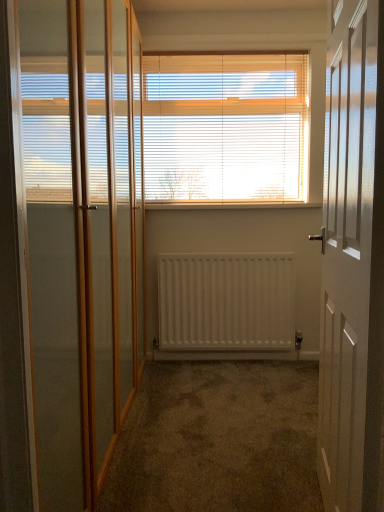
The height and width of the screenshot is (512, 384). I want to click on clear glass screen door at left, so click(81, 233).

The width and height of the screenshot is (384, 512). Find the location of `white wood blinds at center`. white wood blinds at center is located at coordinates (225, 127).

From the image's perspective, is white wood blinds at center located above white matte radiator at center?

Yes, from the image's perspective, white wood blinds at center is over white matte radiator at center.

Is white wood blinds at center closer to camera compared to white matte radiator at center?

Yes, white wood blinds at center is closer to the camera.

Between white wood blinds at center and white matte radiator at center, which one has less height?

white matte radiator at center.

In the scene shown: From a real-world perspective, who is located lower, white wood blinds at center or white matte radiator at center?

white matte radiator at center, from a real-world perspective.

Locate an element on the screen. The width and height of the screenshot is (384, 512). window blind above the white wooden door at right (from a real-world perspective) is located at coordinates (225, 127).

Is white wood blinds at center oriented away from white wooden door at right?

No.

How many degrees apart are the facing directions of white wood blinds at center and white wooden door at right?

The angle between the facing direction of white wood blinds at center and the facing direction of white wooden door at right is 99.7 degrees.

How far apart are white wood blinds at center and white wooden door at right?

white wood blinds at center and white wooden door at right are 5.24 feet apart from each other.

Between wooden at center and clear glass screen door at left, which one has more height?

Standing taller between the two is clear glass screen door at left.

Between wooden at center and clear glass screen door at left, which one appears on the left side from the viewer's perspective?

clear glass screen door at left.

Is wooden at center closer to camera compared to clear glass screen door at left?

No, wooden at center is further to the viewer.

The width and height of the screenshot is (384, 512). I want to click on screen door that is in front of the wooden at center, so click(81, 233).

Which of these two, white wooden door at right or white matte radiator at center, stands shorter?

white matte radiator at center.

Considering the positions of objects white wooden door at right and white matte radiator at center in the image provided, who is more to the right, white wooden door at right or white matte radiator at center?

From the viewer's perspective, white wooden door at right appears more on the right side.

The image size is (384, 512). In order to click on door above the white matte radiator at center (from a real-world perspective) in this screenshot , I will do `click(353, 266)`.

Considering the sizes of objects white wooden door at right and white matte radiator at center in the image provided, who is thinner, white wooden door at right or white matte radiator at center?

Thinner between the two is white matte radiator at center.

Is white matte radiator at center taller than clear glass screen door at left?

Incorrect, the height of white matte radiator at center is not larger of that of clear glass screen door at left.

Is white matte radiator at center inside the boundaries of clear glass screen door at left, or outside?

white matte radiator at center exists outside the volume of clear glass screen door at left.

Measure the distance from white matte radiator at center to clear glass screen door at left.

4.06 feet.

Is white matte radiator at center oriented away from clear glass screen door at left?

Answer: No, white matte radiator at center's orientation is not away from clear glass screen door at left.

Is clear glass screen door at left turned away from white wooden door at right?

No, clear glass screen door at left is not facing the opposite direction of white wooden door at right.

Considering the sizes of clear glass screen door at left and white wooden door at right in the image, is clear glass screen door at left wider or thinner than white wooden door at right?

Clearly, clear glass screen door at left has more width compared to white wooden door at right.

Can you confirm if clear glass screen door at left is positioned to the left of white wooden door at right?

Yes.

How different are the orientations of clear glass screen door at left and white wooden door at right in degrees?

The facing directions of clear glass screen door at left and white wooden door at right are 171 degrees apart.

Can you confirm if white wood blinds at center is positioned to the left of wooden at center?

Yes.

Which object is wider, white wood blinds at center or wooden at center?

wooden at center.

From the image's perspective, would you say white wood blinds at center is shown under wooden at center?

No, from the image's perspective, white wood blinds at center is not beneath wooden at center.

This screenshot has height=512, width=384. Find the location of `window sill behind the white wood blinds at center`. window sill behind the white wood blinds at center is located at coordinates (230, 205).

At what (x,y) coordinates should I click in order to perform the action: click on radiator on the right of the white wood blinds at center. Please return your answer as a coordinate pair (x, y). Looking at the image, I should click on (226, 302).

Image resolution: width=384 pixels, height=512 pixels. Identify the location of window blind on the left side of white wooden door at right. (225, 127).

Based on their spatial positions, is white matte radiator at center or white wood blinds at center closer to white wooden door at right?

Among the two, white matte radiator at center is located nearer to white wooden door at right.

Which object lies further to the anchor point white wood blinds at center, clear glass screen door at left or white wooden door at right?

white wooden door at right.

Looking at the image, which one is located further to white wooden door at right, wooden at center or white wood blinds at center?

Among the two, wooden at center is located further to white wooden door at right.

Based on their spatial positions, is white matte radiator at center or clear glass screen door at left further from wooden at center?

Based on the image, clear glass screen door at left appears to be further to wooden at center.

Looking at the image, which one is located further to clear glass screen door at left, white wooden door at right or wooden at center?

wooden at center lies further to clear glass screen door at left than the other object.

Which object lies nearer to the anchor point white wood blinds at center, white wooden door at right or white matte radiator at center?

white matte radiator at center lies closer to white wood blinds at center than the other object.

Estimate the real-world distances between objects in this image. Which object is further from white wood blinds at center, white matte radiator at center or white wooden door at right?

white wooden door at right lies further to white wood blinds at center than the other object.

Looking at the image, which one is located further to white matte radiator at center, wooden at center or white wood blinds at center?

The object further to white matte radiator at center is white wood blinds at center.

This screenshot has height=512, width=384. What are the coordinates of `window blind located between clear glass screen door at left and white matte radiator at center in the depth direction` in the screenshot? It's located at (225, 127).

Where is `screen door located between white wooden door at right and white wood blinds at center in the depth direction`? The image size is (384, 512). screen door located between white wooden door at right and white wood blinds at center in the depth direction is located at coordinates (81, 233).

Locate an element on the screen. The width and height of the screenshot is (384, 512). window sill between white wood blinds at center and white matte radiator at center in the vertical direction is located at coordinates (230, 205).

The height and width of the screenshot is (512, 384). Identify the location of radiator between clear glass screen door at left and wooden at center along the z-axis. tap(226, 302).